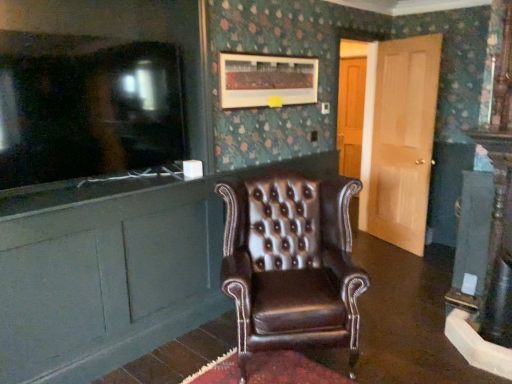
Locate an element on the screen. This screenshot has width=512, height=384. free space to the left of light brown wood door at right is located at coordinates (370, 249).